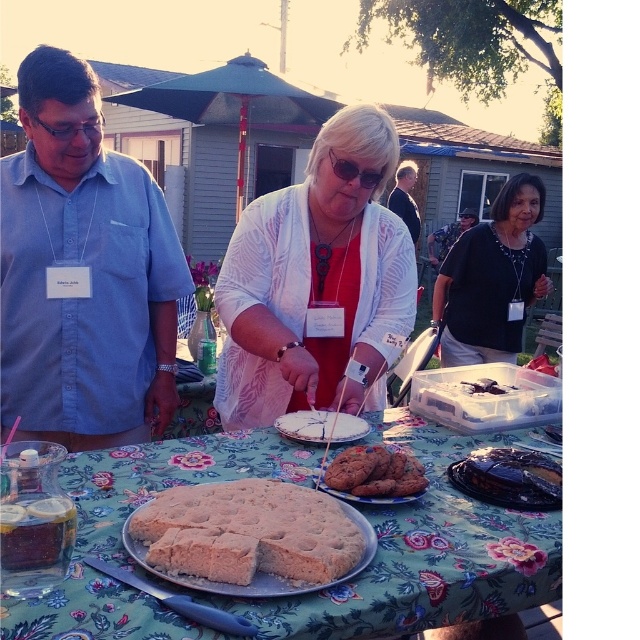
You are at a picnic and need to place both the white matte plate at center and the matte black sunglasses at center on the table. Which item should you place first if you want to ensure there is enough space for both?

The white matte plate at center might be wider than matte black sunglasses at center, so you should place the white matte plate at center first to ensure there is enough space for both items.